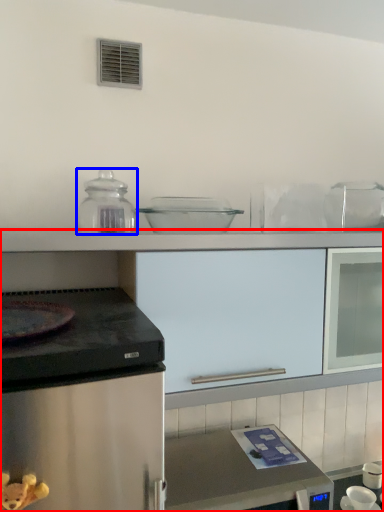
Question: Which object appears closest to the camera in this image, cabinetry (highlighted by a red box) or kitchen appliance (highlighted by a blue box)?

Choices:
 (A) cabinetry
 (B) kitchen appliance

Answer: (A)